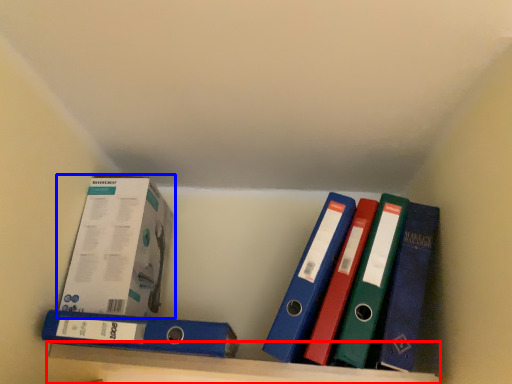
Question: Which of the following is the closest to the observer, shelf (highlighted by a red box) or box (highlighted by a blue box)?

Choices:
 (A) shelf
 (B) box

Answer: (A)